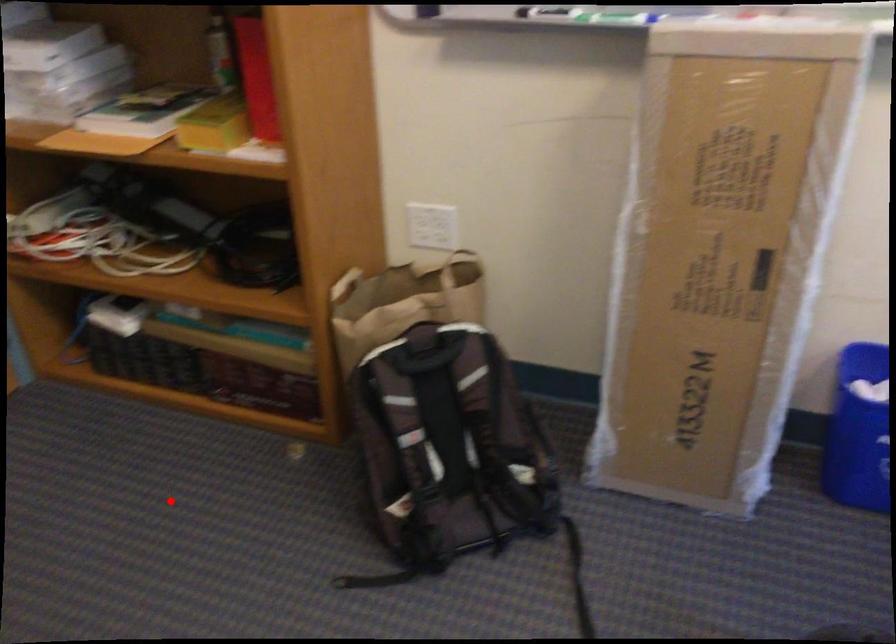
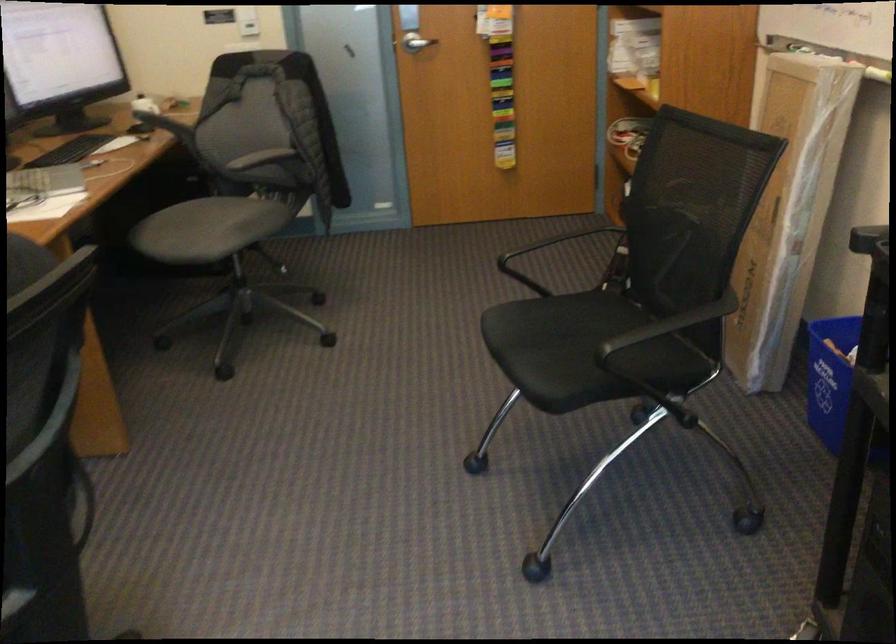
The point at the highlighted location is marked in the first image. Where is the corresponding point in the second image?

(573, 259)